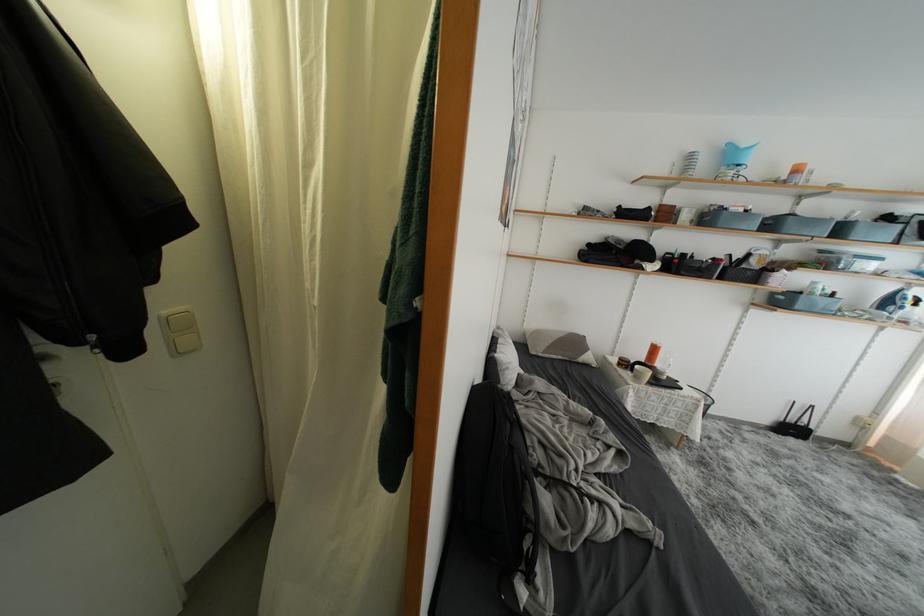
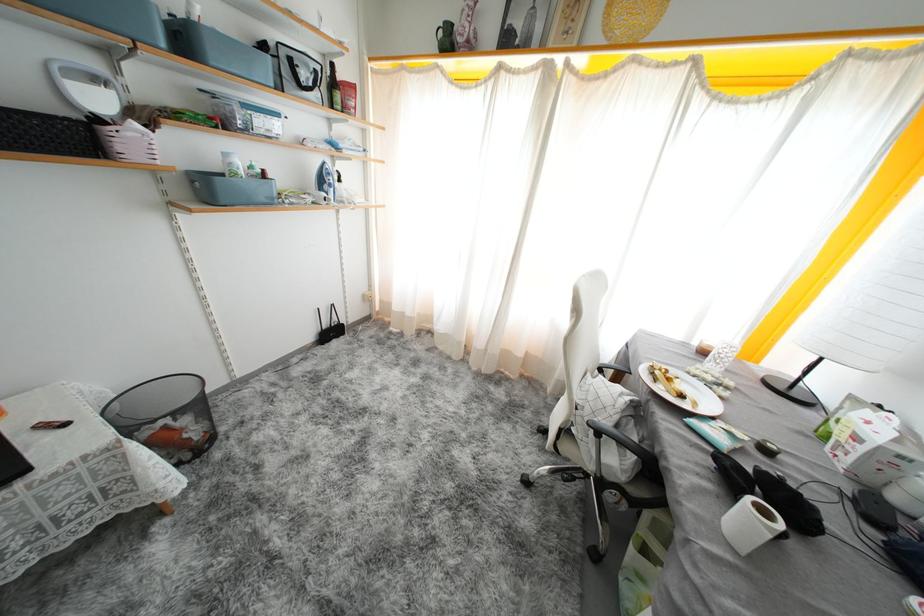
The point at (x=787, y=305) is marked in the first image. Where is the corresponding point in the second image?

(215, 196)